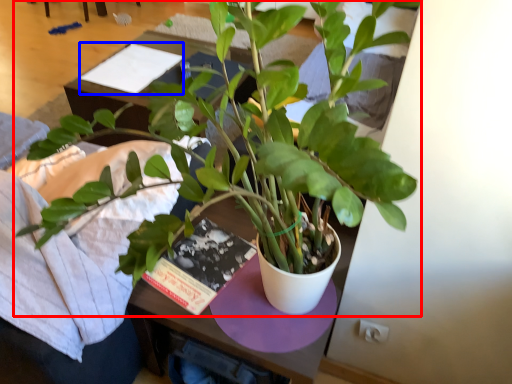
Question: Which object is further to the camera taking this photo, houseplant (highlighted by a red box) or book (highlighted by a blue box)?

Choices:
 (A) houseplant
 (B) book

Answer: (B)